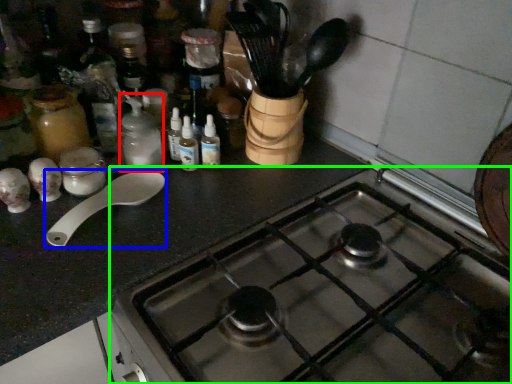
Question: Considering the real-world distances, which object is farthest from bottle (highlighted by a red box)? spoon (highlighted by a blue box) or gas stove (highlighted by a green box)?

Choices:
 (A) spoon
 (B) gas stove

Answer: (B)